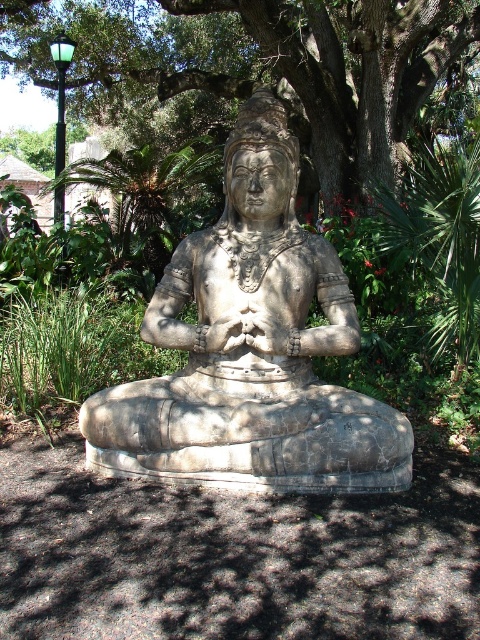
You are a landscape designer planning to add a new sculpture to the garden. You see the gray stone statue at center and the green leafy tree at center. Which object is smaller in size?

The gray stone statue at center is smaller in size compared to the green leafy tree at center.

You are standing in a garden and see the gray stone statue at center and the green leafy tree at center. Which one is positioned to the left?

The gray stone statue at center is positioned to the left of the green leafy tree at center.